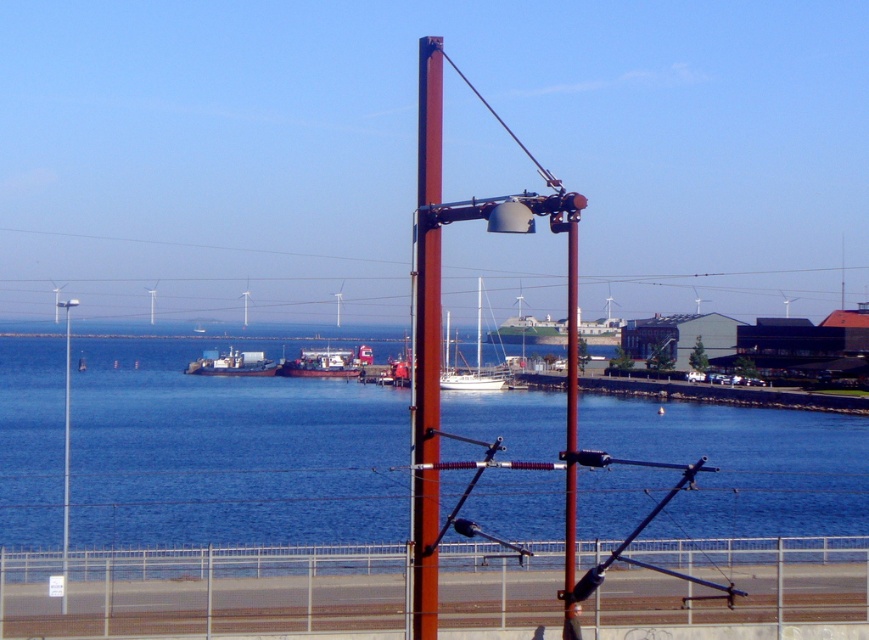
Question: Can you confirm if blue water at center is positioned to the left of white plastic boat at center?

Choices:
 (A) yes
 (B) no

Answer: (B)

Question: Does smooth brown pole at center have a lesser width compared to metallic gray ship at center?

Choices:
 (A) no
 (B) yes

Answer: (B)

Question: Does blue water at center appear on the left side of white plastic boat at center?

Choices:
 (A) no
 (B) yes

Answer: (A)

Question: Which point is farther to the camera?

Choices:
 (A) (224, 369)
 (B) (25, 394)

Answer: (A)

Question: Among these objects, which one is nearest to the camera?

Choices:
 (A) brown metallic pole at center
 (B) smooth brown pole at center
 (C) white plastic boat at center
 (D) white glossy sailboat at center

Answer: (B)

Question: Which point appears closest to the camera in this image?

Choices:
 (A) (283, 513)
 (B) (240, 374)
 (C) (567, 586)

Answer: (C)